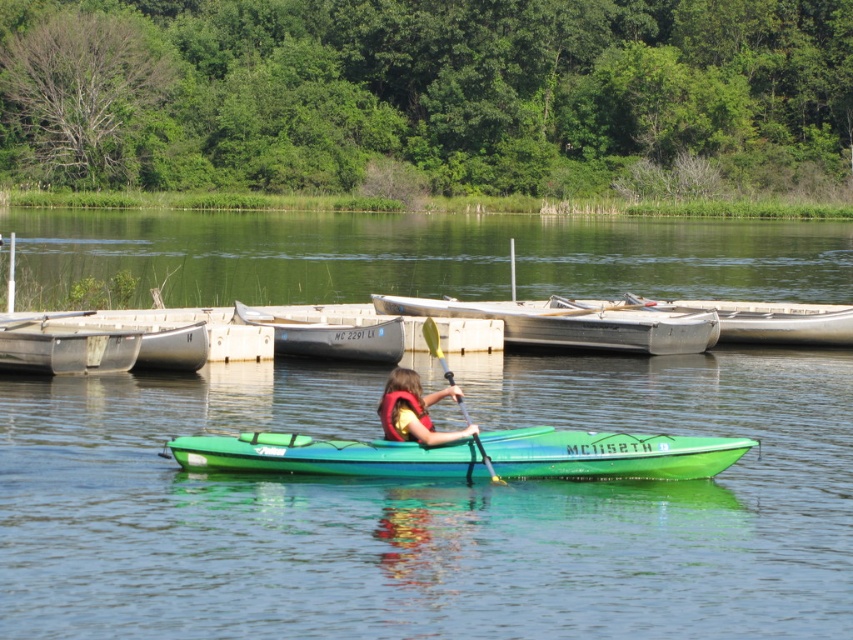
Who is positioned more to the left, silver metallic rowboat at center or yellow plastic paddle at center?

From the viewer's perspective, yellow plastic paddle at center appears more on the left side.

Is silver metallic rowboat at center to the right of yellow plastic paddle at center from the viewer's perspective?

Indeed, silver metallic rowboat at center is positioned on the right side of yellow plastic paddle at center.

You are a GUI agent. You are given a task and a screenshot of the screen. Output one action in this format:
    pyautogui.click(x=<x>, y=<y>)
    Task: Click on the silver metallic rowboat at center
    The height and width of the screenshot is (640, 853).
    Given the screenshot: What is the action you would take?
    pyautogui.click(x=573, y=323)

Does yellow plastic paddle at center have a greater height compared to smooth white paddle at left?

Correct, yellow plastic paddle at center is much taller as smooth white paddle at left.

Locate an element on the screen. Image resolution: width=853 pixels, height=640 pixels. yellow plastic paddle at center is located at coordinates (434, 346).

Is transparent water at center smaller than smooth white paddle at left?

No, transparent water at center is not smaller than smooth white paddle at left.

Is transparent water at center in front of smooth white paddle at left?

Yes.

What are the coordinates of `transparent water at center` in the screenshot? It's located at 430,508.

What are the coordinates of `transparent water at center` in the screenshot? It's located at (430, 508).